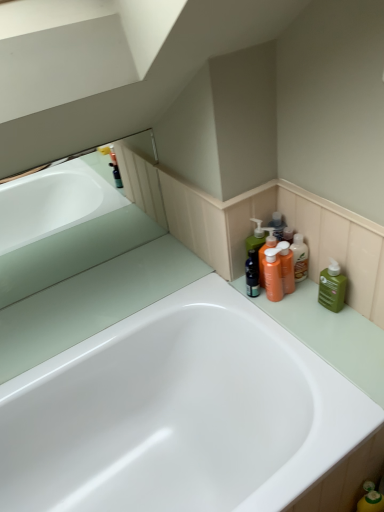
Question: Does white glossy bathtub at center have a lesser height compared to matte glass bathtub at upper left?

Choices:
 (A) no
 (B) yes

Answer: (A)

Question: Considering the relative positions of white glossy bathtub at center and matte glass bathtub at upper left in the image provided, is white glossy bathtub at center to the left of matte glass bathtub at upper left from the viewer's perspective?

Choices:
 (A) yes
 (B) no

Answer: (B)

Question: From the image's perspective, is white glossy bathtub at center on matte glass bathtub at upper left?

Choices:
 (A) no
 (B) yes

Answer: (A)

Question: Is white glossy bathtub at center closer to camera compared to matte glass bathtub at upper left?

Choices:
 (A) yes
 (B) no

Answer: (A)

Question: From a real-world perspective, is white glossy bathtub at center over matte glass bathtub at upper left?

Choices:
 (A) yes
 (B) no

Answer: (B)

Question: Can you confirm if white glossy bathtub at center is bigger than matte glass bathtub at upper left?

Choices:
 (A) no
 (B) yes

Answer: (B)

Question: Is orange matte pump bottle at upper right, which is counted as the 1th cleaning product, starting from the left, looking in the opposite direction of translucent orange bottle at right?

Choices:
 (A) yes
 (B) no

Answer: (A)

Question: Is orange matte pump bottle at upper right, which is counted as the 1th cleaning product, starting from the left, to the left of translucent orange bottle at right from the viewer's perspective?

Choices:
 (A) no
 (B) yes

Answer: (B)

Question: Is orange matte pump bottle at upper right, which is counted as the 1th cleaning product, starting from the left, bigger than translucent orange bottle at right?

Choices:
 (A) yes
 (B) no

Answer: (A)

Question: Does orange matte pump bottle at upper right, the second cleaning product positioned from the right, come behind translucent orange bottle at right?

Choices:
 (A) yes
 (B) no

Answer: (B)

Question: Considering the relative sizes of orange matte pump bottle at upper right, the second cleaning product positioned from the right, and translucent orange bottle at right in the image provided, is orange matte pump bottle at upper right, the second cleaning product positioned from the right, shorter than translucent orange bottle at right?

Choices:
 (A) yes
 (B) no

Answer: (B)

Question: Is translucent orange bottle at right completely or partially inside orange matte pump bottle at upper right, which is counted as the 1th cleaning product, starting from the left?

Choices:
 (A) yes
 (B) no

Answer: (B)

Question: Is green matte bottle at right, acting as the 1th cleaning product starting from the right, not inside orange matte pump bottle at upper right, the second cleaning product positioned from the right?

Choices:
 (A) no
 (B) yes

Answer: (B)